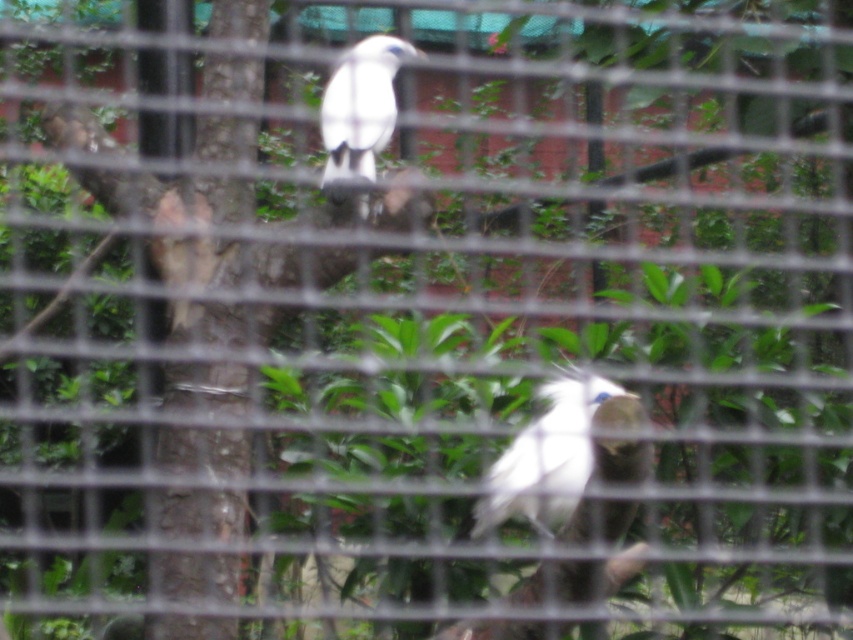
Question: In this image, where is white feathered bird at center located relative to white feathered bird at upper center?

Choices:
 (A) below
 (B) above

Answer: (A)

Question: Can you confirm if white feathered bird at center is positioned to the left of white feathered bird at upper center?

Choices:
 (A) no
 (B) yes

Answer: (A)

Question: Considering the relative positions of white feathered bird at center and white feathered bird at upper center in the image provided, where is white feathered bird at center located with respect to white feathered bird at upper center?

Choices:
 (A) right
 (B) left

Answer: (A)